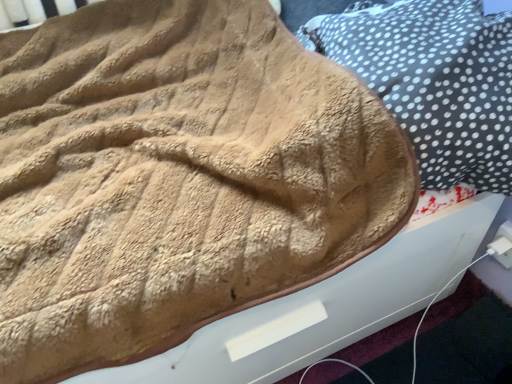
Question: Is beige fuzzy pillow at upper right bigger than white plastic plug at lower right?

Choices:
 (A) no
 (B) yes

Answer: (B)

Question: Does beige fuzzy pillow at upper right lie in front of white plastic plug at lower right?

Choices:
 (A) yes
 (B) no

Answer: (A)

Question: Considering the relative sizes of beige fuzzy pillow at upper right and white plastic plug at lower right in the image provided, is beige fuzzy pillow at upper right taller than white plastic plug at lower right?

Choices:
 (A) no
 (B) yes

Answer: (B)

Question: Is white plastic plug at lower right at the back of beige fuzzy pillow at upper right?

Choices:
 (A) yes
 (B) no

Answer: (B)

Question: Is beige fuzzy pillow at upper right wider than white plastic plug at lower right?

Choices:
 (A) yes
 (B) no

Answer: (A)

Question: Considering the relative sizes of beige fuzzy pillow at upper right and white plastic plug at lower right in the image provided, is beige fuzzy pillow at upper right smaller than white plastic plug at lower right?

Choices:
 (A) yes
 (B) no

Answer: (B)

Question: Does white plastic plug at lower right have a greater width compared to beige fuzzy pillow at upper right?

Choices:
 (A) no
 (B) yes

Answer: (A)

Question: Is white plastic plug at lower right closer to the viewer compared to beige fuzzy pillow at upper right?

Choices:
 (A) no
 (B) yes

Answer: (A)

Question: Does white plastic plug at lower right have a greater height compared to beige fuzzy pillow at upper right?

Choices:
 (A) no
 (B) yes

Answer: (A)

Question: From a real-world perspective, is white plastic plug at lower right on beige fuzzy pillow at upper right?

Choices:
 (A) no
 (B) yes

Answer: (A)

Question: From a real-world perspective, is white plastic plug at lower right under beige fuzzy pillow at upper right?

Choices:
 (A) no
 (B) yes

Answer: (B)

Question: Considering the relative sizes of white plastic plug at lower right and beige fuzzy pillow at upper right in the image provided, is white plastic plug at lower right thinner than beige fuzzy pillow at upper right?

Choices:
 (A) yes
 (B) no

Answer: (A)

Question: From a real-world perspective, is white plastic plug at lower right above or below beige fuzzy pillow at upper right?

Choices:
 (A) below
 (B) above

Answer: (A)